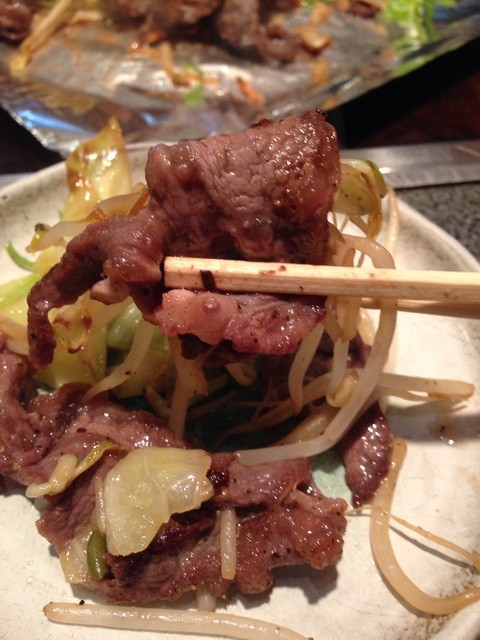
Where is `plate`? The image size is (480, 640). plate is located at coordinates (451, 339).